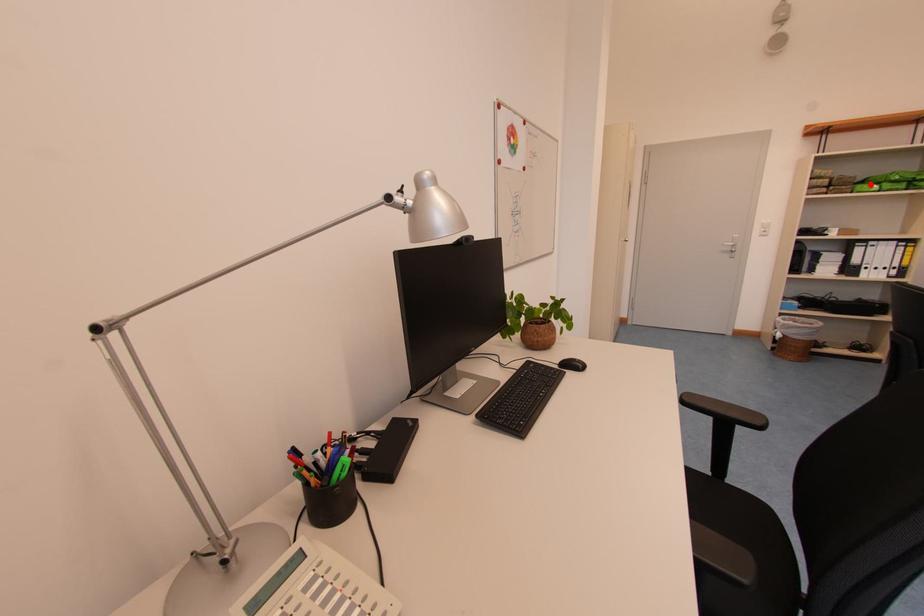
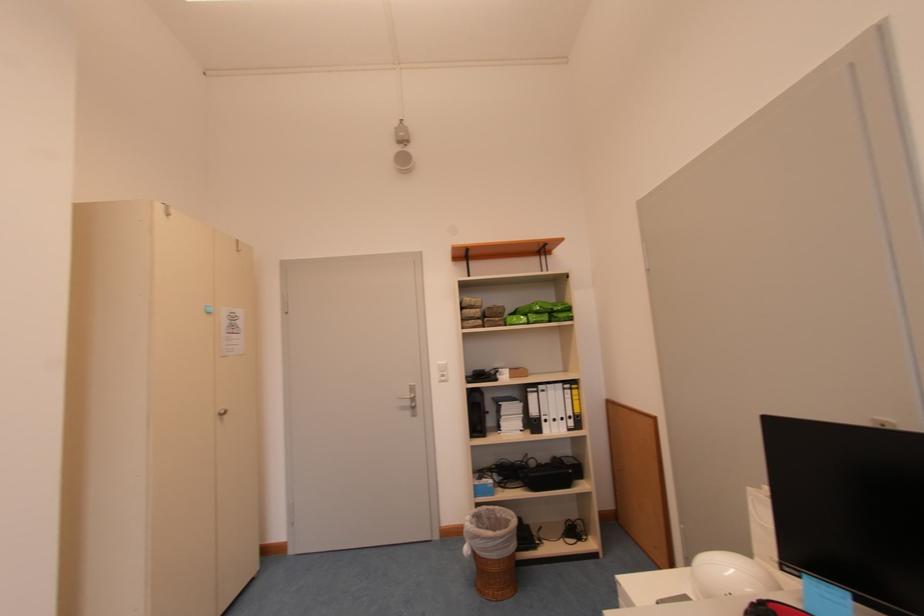
Question: I am providing you with two images of the same scene from different viewpoints. A red point is marked on the first image. Can you still see the location of the red point in image 2?

Choices:
 (A) Yes
 (B) No

Answer: (A)